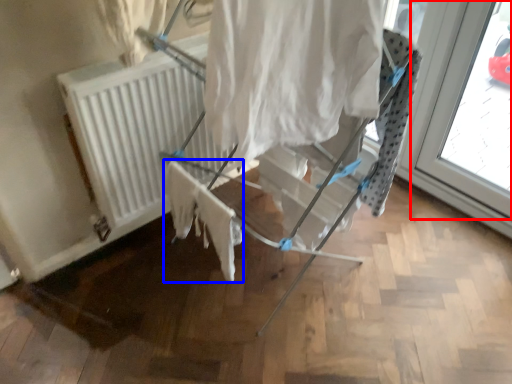
Question: Which object is closer to the camera taking this photo, window (highlighted by a red box) or fabric (highlighted by a blue box)?

Choices:
 (A) window
 (B) fabric

Answer: (B)